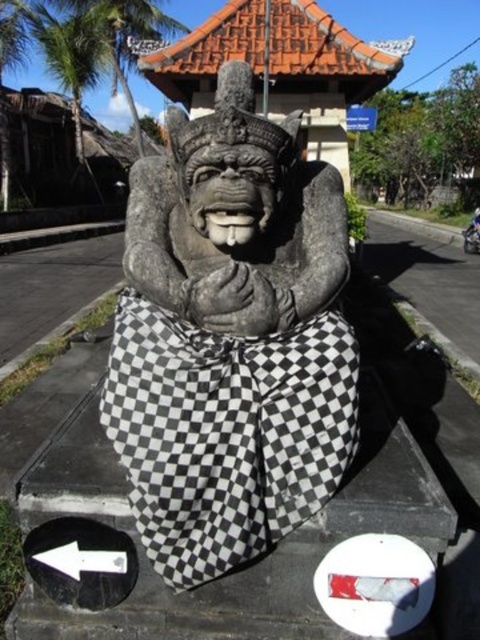
Is green leafy palm tree at upper left bigger than metallic silver motorcycle at center?

Yes, green leafy palm tree at upper left is bigger than metallic silver motorcycle at center.

Can you confirm if green leafy palm tree at upper left is shorter than metallic silver motorcycle at center?

In fact, green leafy palm tree at upper left may be taller than metallic silver motorcycle at center.

Where is `green leafy palm tree at upper left`? This screenshot has height=640, width=480. green leafy palm tree at upper left is located at coordinates (126, 35).

Between stone statue at center and green leafy palm tree at upper left, which one has less height?

Standing shorter between the two is stone statue at center.

What do you see at coordinates (230, 339) in the screenshot? This screenshot has height=640, width=480. I see `stone statue at center` at bounding box center [230, 339].

Between point (332, 340) and point (134, 128), which one is positioned in front?

Point (332, 340)

The height and width of the screenshot is (640, 480). What are the coordinates of `stone statue at center` in the screenshot? It's located at (230, 339).

Can you confirm if stone statue at center is bigger than metallic silver motorcycle at center?

No.

Which of these two, stone statue at center or metallic silver motorcycle at center, stands shorter?

stone statue at center is shorter.

Between point (186, 285) and point (468, 246), which one is positioned in front?

Point (186, 285)

Find the location of a particular element. This screenshot has height=640, width=480. stone statue at center is located at coordinates (230, 339).